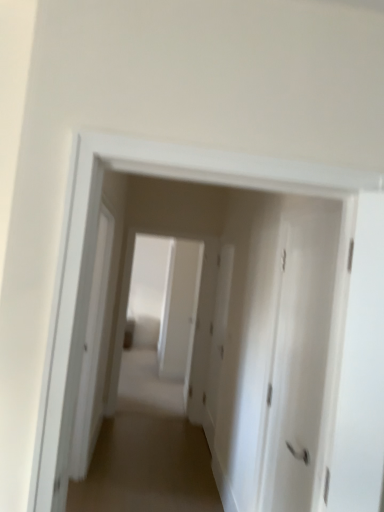
Question: From a real-world perspective, is brown carpet at center on top of white matte door at center, the second door when ordered from front to back?

Choices:
 (A) yes
 (B) no

Answer: (B)

Question: Could white matte door at center, the second door when ordered from front to back, be considered to be inside brown carpet at center?

Choices:
 (A) no
 (B) yes

Answer: (A)

Question: Is brown carpet at center positioned before white matte door at center, the second door when ordered from front to back?

Choices:
 (A) no
 (B) yes

Answer: (B)

Question: Is brown carpet at center shorter than white matte door at center, the second door when ordered from front to back?

Choices:
 (A) no
 (B) yes

Answer: (B)

Question: Does brown carpet at center lie behind white matte door at center, placed as the first door when sorted from back to front?

Choices:
 (A) yes
 (B) no

Answer: (B)

Question: From the image's perspective, is brown carpet at center on white matte door at center, placed as the first door when sorted from back to front?

Choices:
 (A) yes
 (B) no

Answer: (B)

Question: Is brown carpet at center further to the viewer compared to white matte door at center, placed as the first door when sorted from front to back?

Choices:
 (A) no
 (B) yes

Answer: (B)

Question: Considering the relative positions of brown carpet at center and white matte door at center, placed as the first door when sorted from front to back, in the image provided, is brown carpet at center to the right of white matte door at center, placed as the first door when sorted from front to back, from the viewer's perspective?

Choices:
 (A) yes
 (B) no

Answer: (B)

Question: Considering the relative positions of brown carpet at center and white matte door at center, placed as the first door when sorted from front to back, in the image provided, is brown carpet at center to the left of white matte door at center, placed as the first door when sorted from front to back, from the viewer's perspective?

Choices:
 (A) yes
 (B) no

Answer: (A)

Question: Is brown carpet at center outside white matte door at center, placed as the first door when sorted from front to back?

Choices:
 (A) no
 (B) yes

Answer: (B)

Question: Is brown carpet at center taller than white matte door at center, which is the 2th door in back-to-front order?

Choices:
 (A) no
 (B) yes

Answer: (A)

Question: Is white matte door at center, which is the 2th door in back-to-front order, inside brown carpet at center?

Choices:
 (A) no
 (B) yes

Answer: (A)

Question: Can you confirm if white matte door at center, which is the 2th door in back-to-front order, is bigger than brown carpet at center?

Choices:
 (A) yes
 (B) no

Answer: (B)